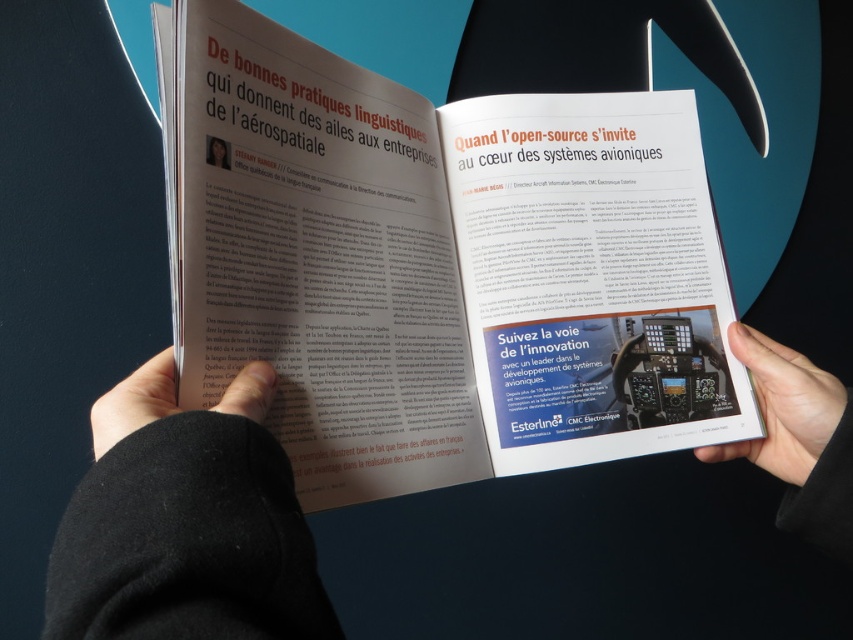
Is black fabric hand at upper center thinner than black matte hand at lower left?

No, black fabric hand at upper center is not thinner than black matte hand at lower left.

Does black fabric hand at upper center lie behind black matte hand at lower left?

That is False.

Who is more distant from viewer, [270,468] or [146,372]?

The point [146,372] is more distant.

The height and width of the screenshot is (640, 853). What are the coordinates of `black fabric hand at upper center` in the screenshot? It's located at (184, 524).

Is point (762, 400) closer to viewer compared to point (816, 458)?

No, it is not.

Does black fabric hand at upper center appear on the right side of black matte hand at lower right?

Incorrect, black fabric hand at upper center is not on the right side of black matte hand at lower right.

Identify the location of black fabric hand at upper center. This screenshot has width=853, height=640. (184, 524).

Locate an element on the screen. black fabric hand at upper center is located at coordinates (184, 524).

Does point (785, 404) come farther from viewer compared to point (271, 380)?

Yes, it is behind point (271, 380).

Between black matte hand at lower right and black matte hand at lower left, which one appears on the left side from the viewer's perspective?

black matte hand at lower left

Does point (764, 337) come farther from viewer compared to point (248, 376)?

Yes.

This screenshot has height=640, width=853. In order to click on black matte hand at lower right in this screenshot , I will do (x=782, y=406).